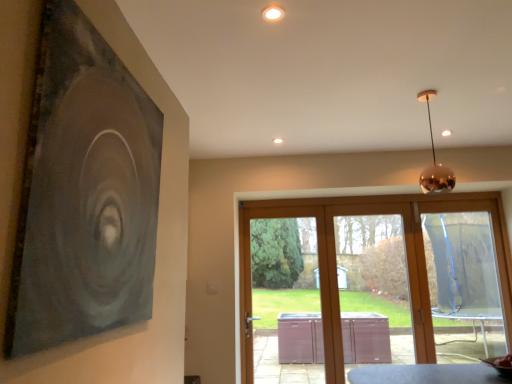
Question: Is point (445, 256) positioned closer to the camera than point (24, 188)?

Choices:
 (A) closer
 (B) farther

Answer: (B)

Question: From a real-world perspective, relative to matte black painting at upper left, is transparent plastic screen at right vertically above or below?

Choices:
 (A) above
 (B) below

Answer: (B)

Question: Which object is the farthest from the copper metallic sphere at upper right?

Choices:
 (A) matte black painting at upper left
 (B) transparent glass door at center
 (C) white glossy light fixture at upper center
 (D) transparent plastic screen at right
 (E) transparent plastic screen door at center

Answer: (E)

Question: Considering the real-world distances, which object is farthest from the transparent plastic screen door at center?

Choices:
 (A) white glossy light fixture at upper center
 (B) copper metallic sphere at upper right
 (C) transparent glass door at center
 (D) matte black painting at upper left
 (E) transparent plastic screen at right

Answer: (A)